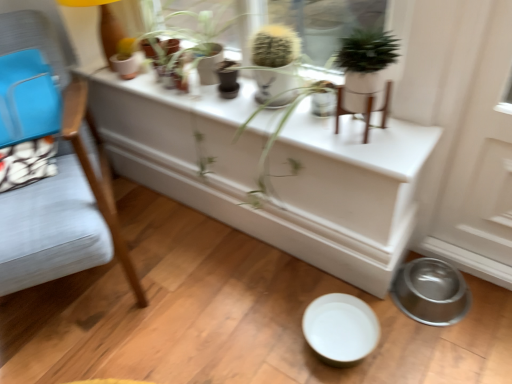
Question: Is matte white flowerpot at upper left bigger or smaller than fuzzy green cactus at upper center, the second houseplant from the front?

Choices:
 (A) big
 (B) small

Answer: (B)

Question: Is matte white flowerpot at upper left spatially inside fuzzy green cactus at upper center, which is the second houseplant in right-to-left order, or outside of it?

Choices:
 (A) outside
 (B) inside

Answer: (A)

Question: Estimate the real-world distances between objects in this image. Which object is closer to the green leafy plant at upper center?

Choices:
 (A) light blue fabric chair at left
 (B) matte white flowerpot at upper left
 (C) green matte plant at upper center, which appears as the 2th houseplant when viewed from the back
 (D) white glossy table at center
 (E) metallic silver bowl at lower right

Answer: (D)

Question: Estimate the real-world distances between objects in this image. Which object is farther from the green leafy plant at upper center?

Choices:
 (A) matte white flowerpot at upper left
 (B) metallic silver bowl at lower right
 (C) fuzzy green cactus at upper center, which is the 1th houseplant from back to front
 (D) green matte plant at upper center, which appears as the first houseplant when viewed from the right
 (E) white glossy table at center

Answer: (B)